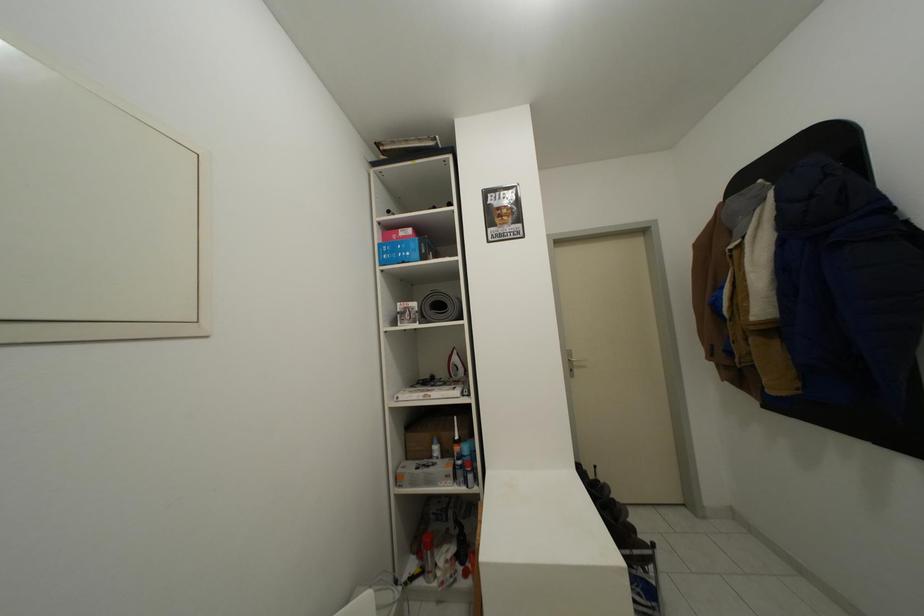
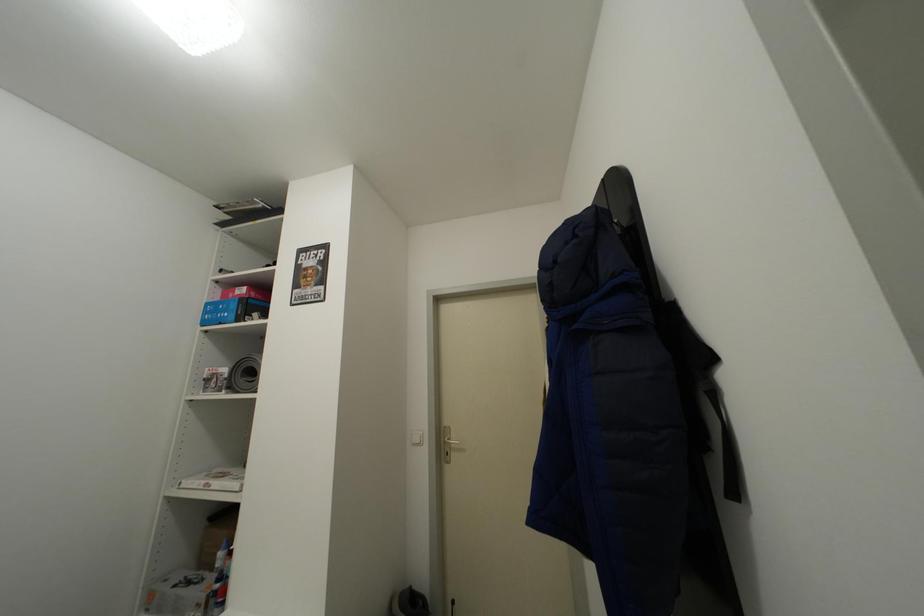
Question: What movement of the cameraman would produce the second image?

Choices:
 (A) Left
 (B) Right
 (C) Forward
 (D) Backward

Answer: (B)